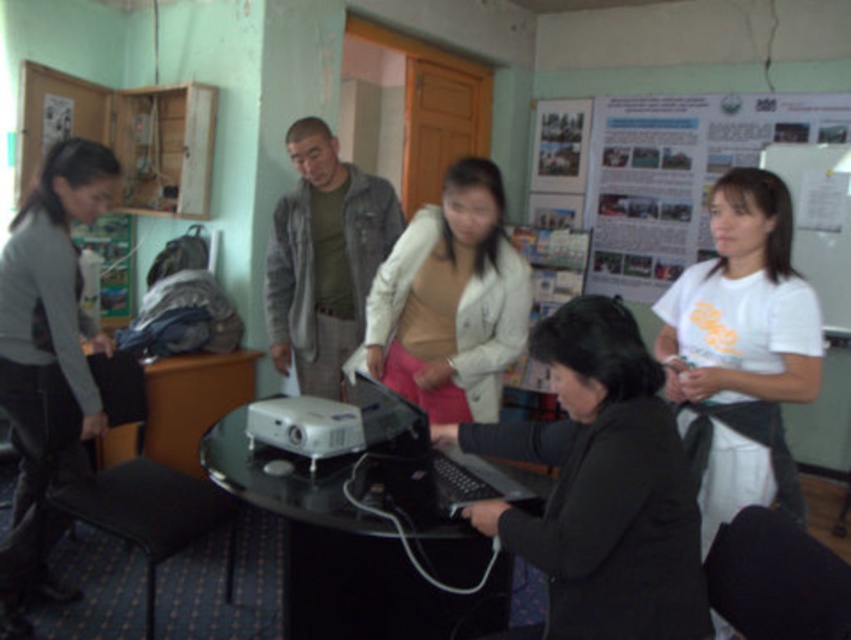
Is gray sweater at left below black plastic laptop at center?

Actually, gray sweater at left is above black plastic laptop at center.

Does point (89, 428) come closer to viewer compared to point (443, 497)?

No, it is not.

At what (x,y) coordinates should I click in order to perform the action: click on gray sweater at left. Please return your answer as a coordinate pair (x, y). The width and height of the screenshot is (851, 640). Looking at the image, I should click on (49, 353).

I want to click on gray sweater at left, so click(x=49, y=353).

Does black matte jacket at lower center have a greater height compared to white matte shirt at center?

No, black matte jacket at lower center is not taller than white matte shirt at center.

Is black matte jacket at lower center above white matte shirt at center?

Yes, black matte jacket at lower center is above white matte shirt at center.

Who is more forward, (543, 355) or (741, 397)?

Point (543, 355)

Find the location of a particular element. This screenshot has width=851, height=640. black matte jacket at lower center is located at coordinates (601, 484).

Can you confirm if white textured jacket at center is positioned below black plastic laptop at center?

No, white textured jacket at center is not below black plastic laptop at center.

Who is positioned more to the right, white textured jacket at center or black plastic laptop at center?

From the viewer's perspective, white textured jacket at center appears more on the right side.

Identify the location of white textured jacket at center. (450, 301).